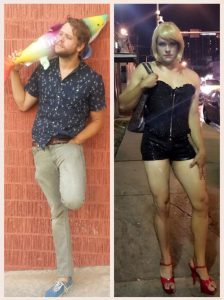
At what (x,y) coordinates should I click in order to perform the action: click on brick wall. Please return your answer as a coordinate pair (x, y). The image size is (224, 300). Looking at the image, I should click on (90, 229).